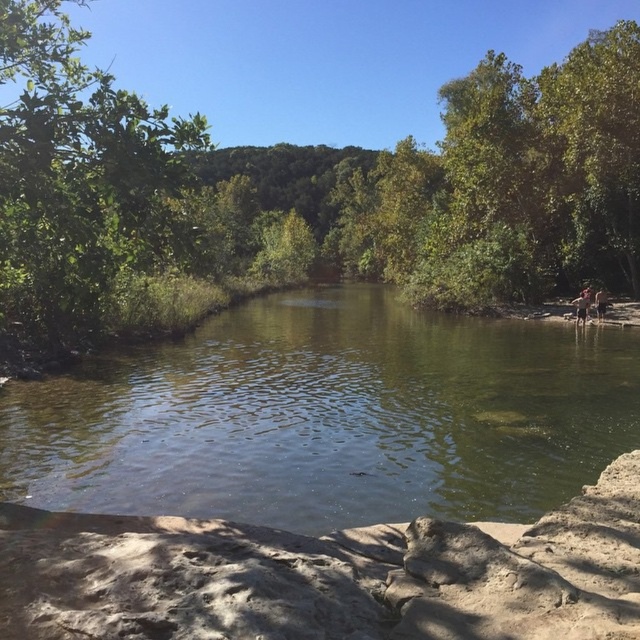
Can you confirm if green leafy tree at center is smaller than green leafy tree at upper left?

No.

How distant is green leafy tree at center from green leafy tree at upper left?

green leafy tree at center is 53.49 meters away from green leafy tree at upper left.

Is point (6, 51) more distant than point (132, 234)?

No, (6, 51) is closer to viewer.

This screenshot has height=640, width=640. What are the coordinates of `green leafy tree at center` in the screenshot? It's located at (300, 193).

Does green translucent water at center have a lesser width compared to green leafy tree at upper left?

Incorrect, green translucent water at center's width is not less than green leafy tree at upper left's.

This screenshot has height=640, width=640. What do you see at coordinates (328, 417) in the screenshot? I see `green translucent water at center` at bounding box center [328, 417].

At what (x,y) coordinates should I click in order to perform the action: click on green translucent water at center. Please return your answer as a coordinate pair (x, y). Looking at the image, I should click on (328, 417).

Where is `green translucent water at center`? The height and width of the screenshot is (640, 640). green translucent water at center is located at coordinates (328, 417).

Can you confirm if green leafy tree at center is thinner than green translucent water at center?

In fact, green leafy tree at center might be wider than green translucent water at center.

Is green leafy tree at center above green translucent water at center?

Yes, green leafy tree at center is above green translucent water at center.

Which is in front, point (220, 189) or point (538, 428)?

Point (538, 428)

This screenshot has height=640, width=640. I want to click on green leafy tree at center, so click(300, 193).